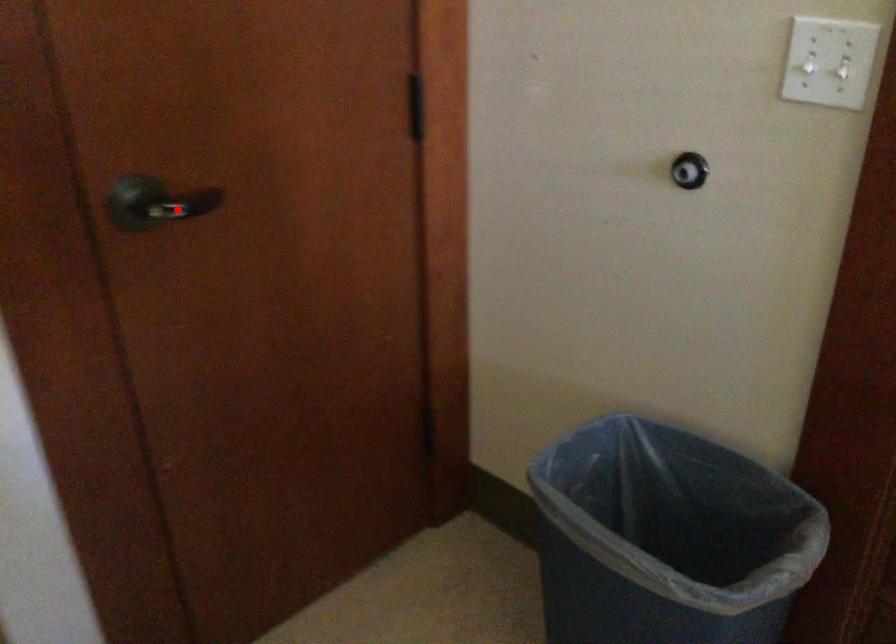
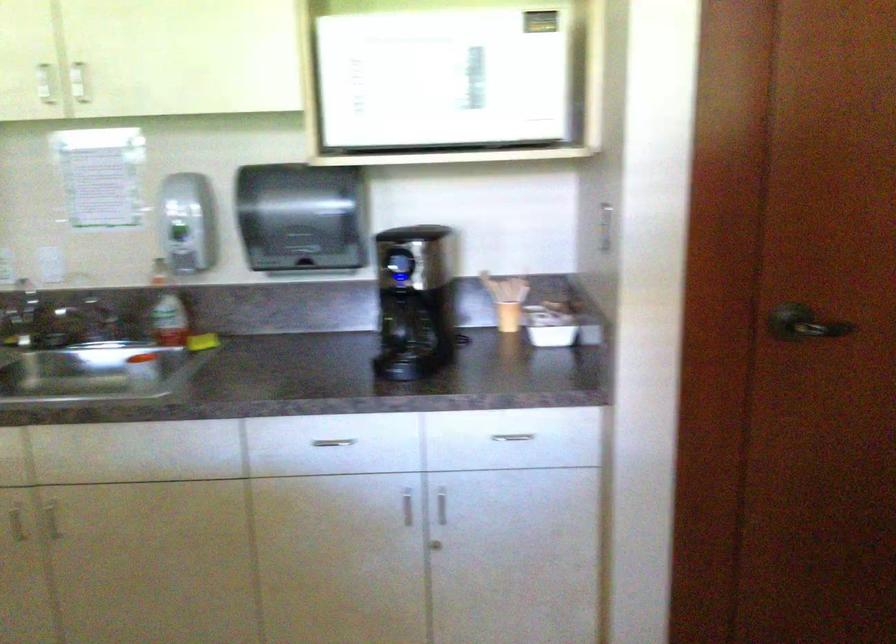
Where in the second image is the point corresponding to the highlighted location from the first image?

(803, 323)